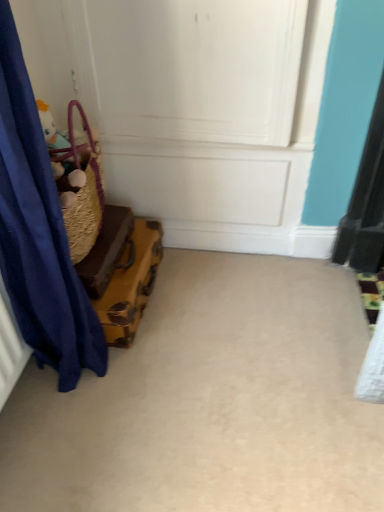
Find the location of a particular element. fluffy plush toy at left is located at coordinates (51, 129).

Describe the element at coordinates (51, 129) in the screenshot. I see `fluffy plush toy at left` at that location.

The height and width of the screenshot is (512, 384). Find the location of `fluffy plush toy at left`. fluffy plush toy at left is located at coordinates 51,129.